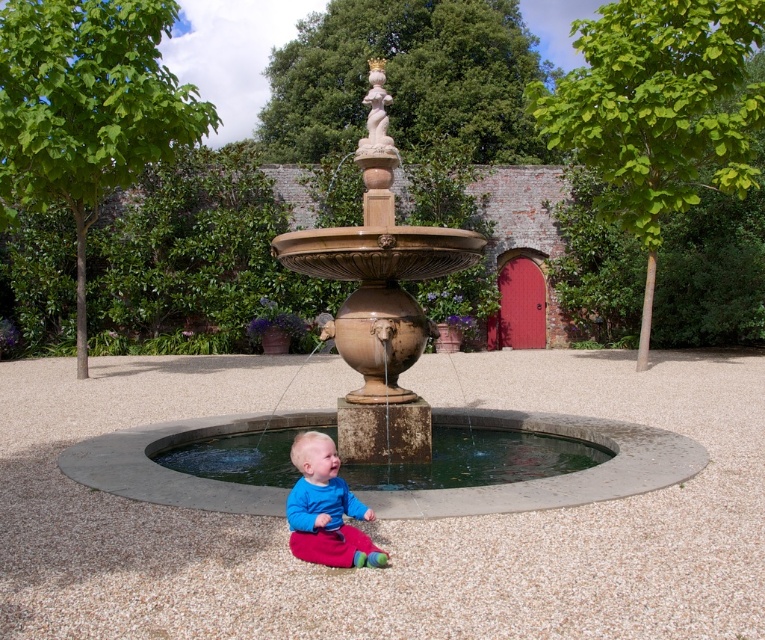
Question: Which of these objects is positioned farthest from the bronze fountain at center?

Choices:
 (A) blue soft fabric baby at center
 (B) white stone statue at upper center
 (C) smooth gravel at center

Answer: (C)

Question: Is bronze fountain at center smaller than blue soft fabric baby at center?

Choices:
 (A) yes
 (B) no

Answer: (B)

Question: Which point appears farthest from the camera in this image?

Choices:
 (A) (168, 419)
 (B) (383, 426)
 (C) (298, 536)

Answer: (A)

Question: Can you confirm if bronze fountain at center is positioned above blue soft fabric baby at center?

Choices:
 (A) yes
 (B) no

Answer: (A)

Question: Is bronze fountain at center above blue soft fabric baby at center?

Choices:
 (A) yes
 (B) no

Answer: (A)

Question: Which is nearer to the white stone statue at upper center?

Choices:
 (A) smooth gravel at center
 (B) bronze fountain at center
 (C) blue soft fabric baby at center

Answer: (B)